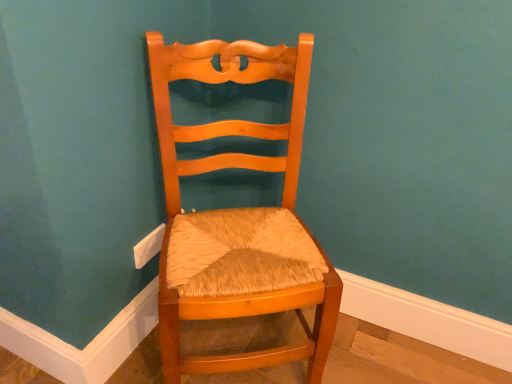
What is the approximate width of matte wood chair at center?

It is 18.92 inches.

Where is `matte wood chair at center`? The image size is (512, 384). matte wood chair at center is located at coordinates (239, 213).

This screenshot has width=512, height=384. Describe the element at coordinates (239, 213) in the screenshot. I see `matte wood chair at center` at that location.

The width and height of the screenshot is (512, 384). I want to click on matte wood chair at center, so click(239, 213).